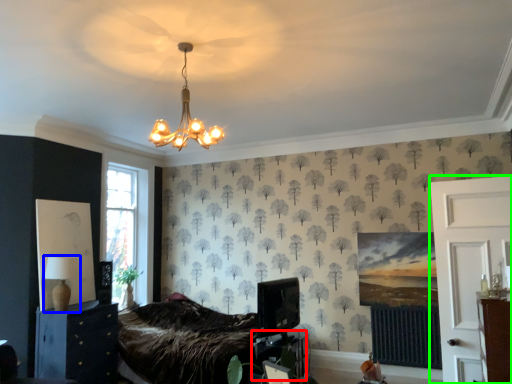
Question: Considering the real-world distances, which object is farthest from table (highlighted by a red box)? table lamp (highlighted by a blue box) or side (highlighted by a green box)?

Choices:
 (A) table lamp
 (B) side

Answer: (A)